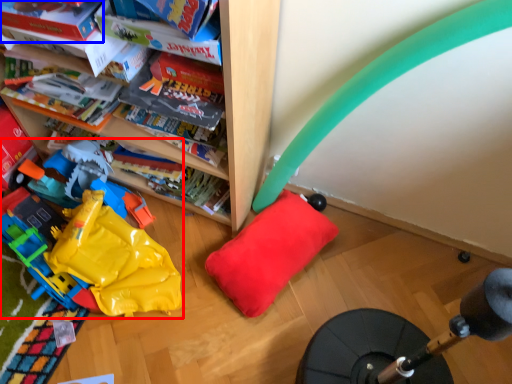
Question: Which object appears closest to the camera in this image, toy (highlighted by a red box) or book (highlighted by a blue box)?

Choices:
 (A) toy
 (B) book

Answer: (B)